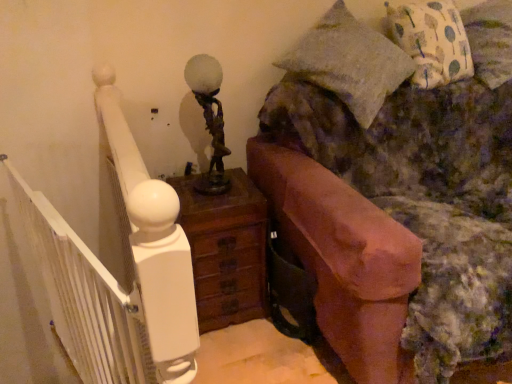
Identify the location of vacant space in bronze/antique brass table lamp at center (from a real-world perspective). Image resolution: width=512 pixels, height=384 pixels. (216, 187).